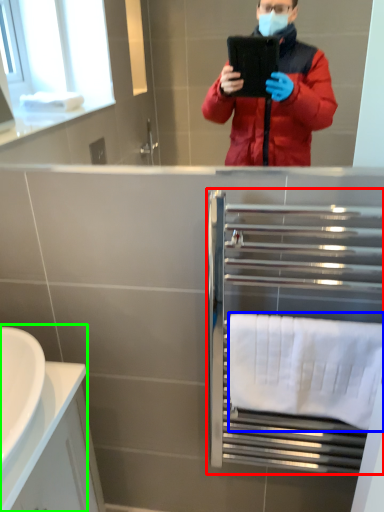
Question: Based on their relative distances, which object is farther from balustrade (highlighted by a red box)? Choose from towel/napkin (highlighted by a blue box) and sink (highlighted by a green box).

Choices:
 (A) towel/napkin
 (B) sink

Answer: (B)